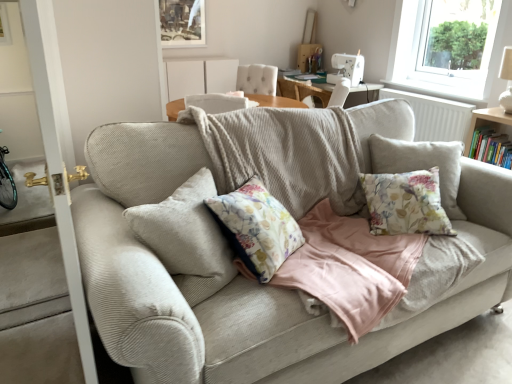
Describe the element at coordinates (435, 116) in the screenshot. The width and height of the screenshot is (512, 384). I see `white textured radiator at upper right` at that location.

The height and width of the screenshot is (384, 512). What do you see at coordinates (243, 279) in the screenshot?
I see `corduroy couch at center` at bounding box center [243, 279].

What do you see at coordinates (490, 147) in the screenshot? I see `hardcover book at right` at bounding box center [490, 147].

What do you see at coordinates (182, 23) in the screenshot?
I see `matte wooden picture frame at upper center` at bounding box center [182, 23].

The width and height of the screenshot is (512, 384). In order to click on white textured radiator at upper right in this screenshot , I will do `click(435, 116)`.

Can you confirm if white textured radiator at upper right is thinner than matte wooden picture frame at upper center?

No, white textured radiator at upper right is not thinner than matte wooden picture frame at upper center.

From a real-world perspective, is white textured radiator at upper right on matte wooden picture frame at upper center?

Incorrect, from a real-world perspective, white textured radiator at upper right is lower than matte wooden picture frame at upper center.

Find the location of a particular element. book below the matte wooden picture frame at upper center (from a real-world perspective) is located at coordinates tap(490, 147).

Based on the photo, from the image's perspective, is hardcover book at right located above matte wooden picture frame at upper center?

No, from the image's perspective, hardcover book at right is not above matte wooden picture frame at upper center.

Considering the relative sizes of hardcover book at right and matte wooden picture frame at upper center in the image provided, is hardcover book at right smaller than matte wooden picture frame at upper center?

Yes, hardcover book at right is smaller than matte wooden picture frame at upper center.

Looking at this image, is white textured radiator at upper right bigger than corduroy couch at center?

Actually, white textured radiator at upper right might be smaller than corduroy couch at center.

Is there a large distance between white textured radiator at upper right and corduroy couch at center?

Yes, white textured radiator at upper right and corduroy couch at center are located far from each other.

From a real-world perspective, is white textured radiator at upper right located beneath corduroy couch at center?

Correct, in the physical world, white textured radiator at upper right is lower than corduroy couch at center.

How far apart are transparent glass window at upper right and white tufted armchair at upper center?

transparent glass window at upper right and white tufted armchair at upper center are 4.17 meters apart.

Which is correct: transparent glass window at upper right is inside white tufted armchair at upper center, or outside of it?

transparent glass window at upper right exists outside the volume of white tufted armchair at upper center.

Is there a large distance between transparent glass window at upper right and white tufted armchair at upper center?

transparent glass window at upper right is positioned a significant distance from white tufted armchair at upper center.

Is transparent glass window at upper right to the left or to the right of white tufted armchair at upper center in the image?

transparent glass window at upper right is to the right of white tufted armchair at upper center.

From a real-world perspective, which is physically above, white tufted armchair at upper center or corduroy couch at center?

white tufted armchair at upper center, from a real-world perspective.

Consider the image. Does white tufted armchair at upper center have a larger size compared to corduroy couch at center?

Incorrect, white tufted armchair at upper center is not larger than corduroy couch at center.

Does hardcover book at right have a lesser width compared to corduroy couch at center?

Correct, the width of hardcover book at right is less than that of corduroy couch at center.

Can you tell me how much hardcover book at right and corduroy couch at center differ in facing direction?

The angle between the facing direction of hardcover book at right and the facing direction of corduroy couch at center is 88.6 degrees.

From a real-world perspective, does hardcover book at right sit lower than corduroy couch at center?

Yes, from a real-world perspective, hardcover book at right is beneath corduroy couch at center.

Would you say corduroy couch at center is part of hardcover book at right's contents?

Actually, corduroy couch at center is outside hardcover book at right.

From a real-world perspective, is white tufted armchair at upper center positioned over matte wooden picture frame at upper center based on gravity?

No, from a real-world perspective, white tufted armchair at upper center is not over matte wooden picture frame at upper center

Relative to matte wooden picture frame at upper center, is white tufted armchair at upper center in front or behind?

Clearly, white tufted armchair at upper center is in front of matte wooden picture frame at upper center.

Find the location of a particular element. picture frame above the white tufted armchair at upper center (from a real-world perspective) is located at coordinates (182, 23).

Based on their sizes in the image, would you say white tufted armchair at upper center is bigger or smaller than matte wooden picture frame at upper center?

Considering their sizes, white tufted armchair at upper center takes up more space than matte wooden picture frame at upper center.

Locate an element on the screen. This screenshot has height=384, width=512. radiator directly beneath the matte wooden picture frame at upper center (from a real-world perspective) is located at coordinates (435, 116).

Where is `picture frame that appears above the hardcover book at right (from a real-world perspective)`? The image size is (512, 384). picture frame that appears above the hardcover book at right (from a real-world perspective) is located at coordinates [182, 23].

When comparing their distances from transparent glass window at upper right, does white textured radiator at upper right or corduroy couch at center seem further?

corduroy couch at center lies further to transparent glass window at upper right than the other object.

Based on their spatial positions, is white textured radiator at upper right or hardcover book at right further from white tufted armchair at upper center?

Among the two, hardcover book at right is located further to white tufted armchair at upper center.

Based on their spatial positions, is white textured radiator at upper right or white tufted armchair at upper center closer to corduroy couch at center?

white textured radiator at upper right lies closer to corduroy couch at center than the other object.

Estimate the real-world distances between objects in this image. Which object is closer to corduroy couch at center, hardcover book at right or matte wooden picture frame at upper center?

hardcover book at right lies closer to corduroy couch at center than the other object.

In the scene shown: Looking at the image, which one is located closer to hardcover book at right, corduroy couch at center or white textured radiator at upper right?

Among the two, white textured radiator at upper right is located nearer to hardcover book at right.

Based on their spatial positions, is white textured radiator at upper right or white tufted armchair at upper center closer to transparent glass window at upper right?

The object closer to transparent glass window at upper right is white textured radiator at upper right.

Which object lies further to the anchor point corduroy couch at center, matte wooden picture frame at upper center or white textured radiator at upper right?

matte wooden picture frame at upper center is further to corduroy couch at center.

Considering their positions, is hardcover book at right positioned closer to matte wooden picture frame at upper center than white tufted armchair at upper center?

white tufted armchair at upper center is closer to matte wooden picture frame at upper center.

Locate an element on the screen. This screenshot has height=384, width=512. book between corduroy couch at center and white tufted armchair at upper center along the z-axis is located at coordinates (490, 147).

The image size is (512, 384). Identify the location of radiator between corduroy couch at center and matte wooden picture frame at upper center in the front-back direction. (435, 116).

This screenshot has width=512, height=384. In order to click on window between corduroy couch at center and white textured radiator at upper right in the front-back direction in this screenshot , I will do `click(451, 49)`.

This screenshot has width=512, height=384. I want to click on armchair located between corduroy couch at center and matte wooden picture frame at upper center in the depth direction, so click(x=257, y=79).